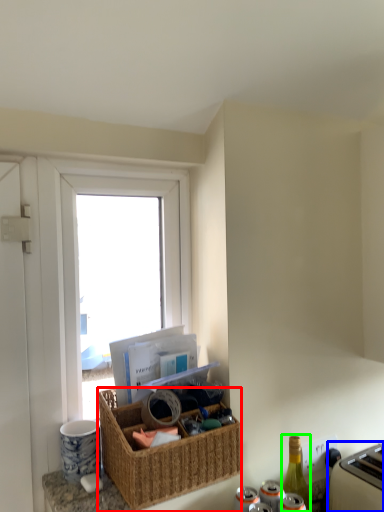
Question: Considering the real-world distances, which object is closest to picnic basket (highlighted by a red box)? appliance (highlighted by a blue box) or bottle (highlighted by a green box).

Choices:
 (A) appliance
 (B) bottle

Answer: (B)